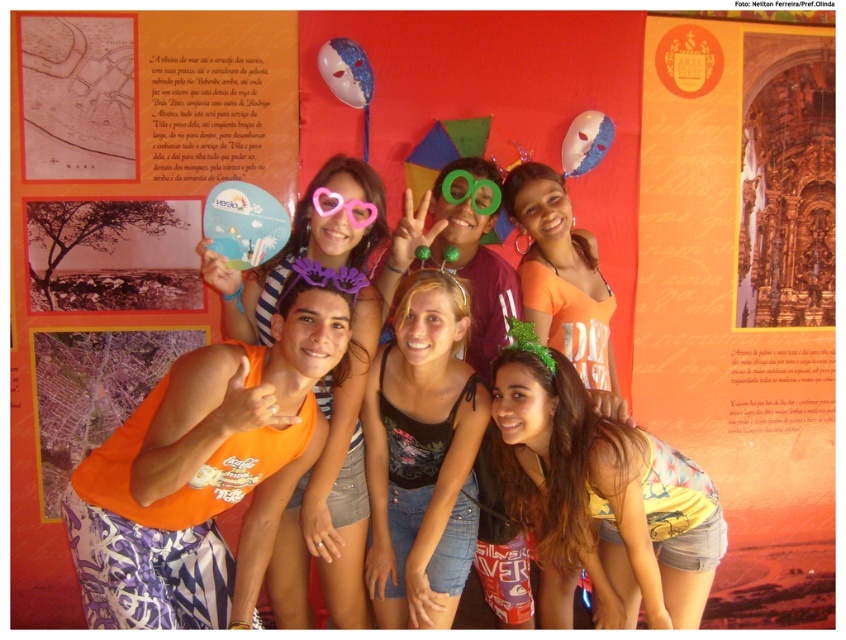
What is the relationship between the width of the orange fabric tank top at center and the orange fabric at center in the image?

The orange fabric tank top at center has a larger width than the orange fabric at center.